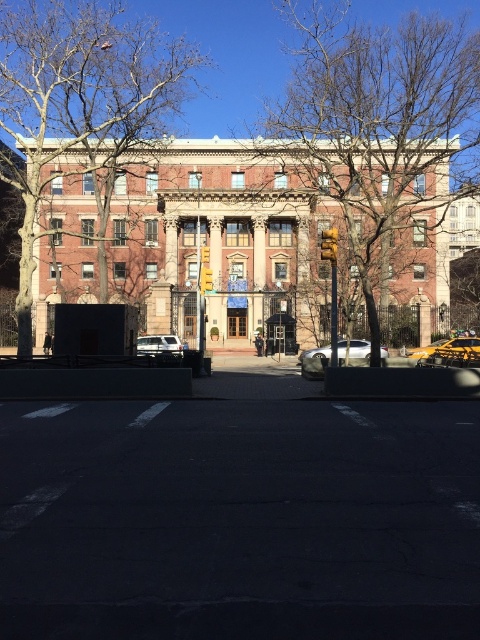
You are standing in front of the building and want to take a photo of the entrance without any trees blocking the view. Based on the coordinates provided, where should you position yourself relative to the brown leafless tree at center?

To avoid the brown leafless tree at center blocking the view, you should position yourself to the right or left of the tree since it is located at point (381, 125). This coordinate places the tree centrally, so moving to either side would provide an unobstructed view of the entrance.

You are a photographer trying to capture the entire building and its surroundings. You notice the brown leafless tree at center and the white matte van at center are both in the frame. Which object should you adjust your camera angle to avoid cropping, and why?

The brown leafless tree at center is bigger than the white matte van at center, so you should adjust your camera angle to avoid cropping the brown leafless tree at center since it takes up more space in the frame.

You are standing in front of the classical building with the entrance marked by double doors. There is a point labeled at coordinates [78,100]. What does this point indicate?

The point at coordinates [78,100] indicates the location of the bare branches at the left side of the image.